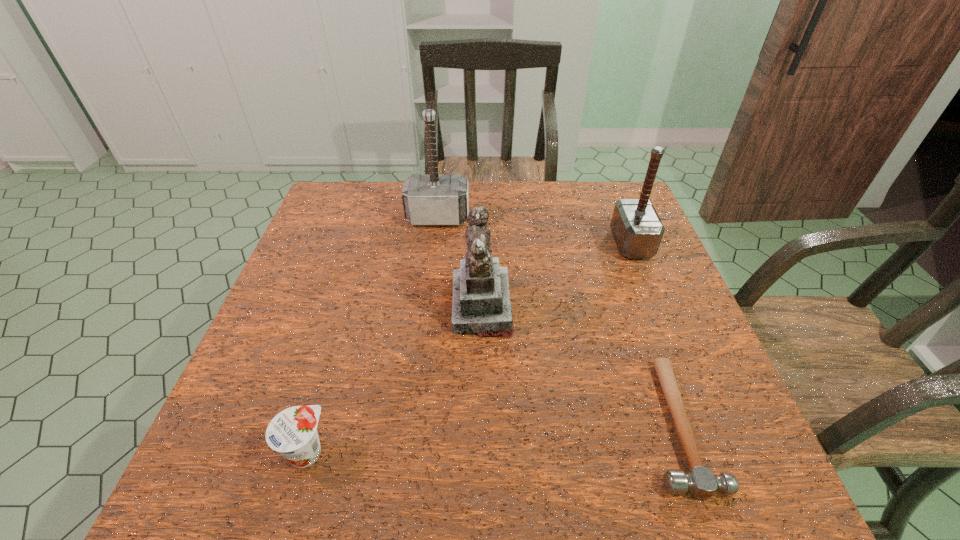
You are a GUI agent. You are given a task and a screenshot of the screen. Output one action in this format:
    pyautogui.click(x=<x>, y=<y>)
    Task: Click on the leftmost hammer
    
    Given the screenshot: What is the action you would take?
    pyautogui.click(x=437, y=199)

This screenshot has height=540, width=960. In order to click on the third nearest object in this screenshot , I will do pos(481,305).

Find the location of a particular element. This screenshot has height=540, width=960. the fourth tallest object is located at coordinates (293, 432).

You are a GUI agent. You are given a task and a screenshot of the screen. Output one action in this format:
    pyautogui.click(x=<x>, y=<y>)
    Task: Click on the leftmost object
    
    Given the screenshot: What is the action you would take?
    pyautogui.click(x=293, y=432)

The image size is (960, 540). In order to click on the shortest object in this screenshot , I will do `click(700, 481)`.

Locate an element on the screen. the shortest hammer is located at coordinates (700, 481).

This screenshot has height=540, width=960. What are the coordinates of `free space located for striking with the head of the leftmost hammer` in the screenshot? It's located at (427, 309).

This screenshot has height=540, width=960. Identify the location of free location located on the front-facing side of the figurine. (414, 307).

Find the location of `blank space located 0.100m on the front-facing side of the figurine`. blank space located 0.100m on the front-facing side of the figurine is located at coordinates (410, 307).

At what (x,y) coordinates should I click in order to perform the action: click on free space located on the front-facing side of the figurine. Please return your answer as a coordinate pair (x, y). Looking at the image, I should click on (384, 307).